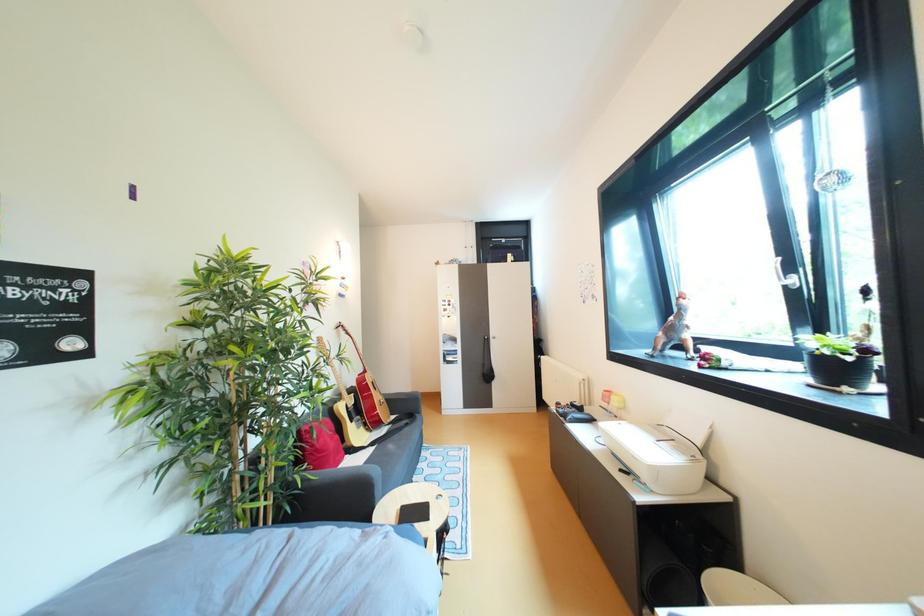
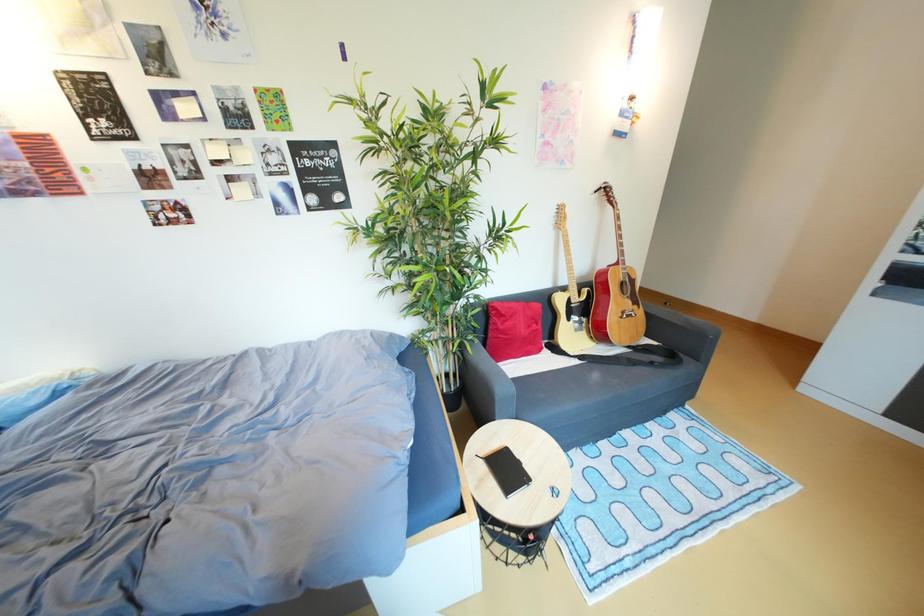
The images are taken continuously from a first-person perspective. In which direction is your viewpoint rotating?

The camera's rotation is toward left-down.